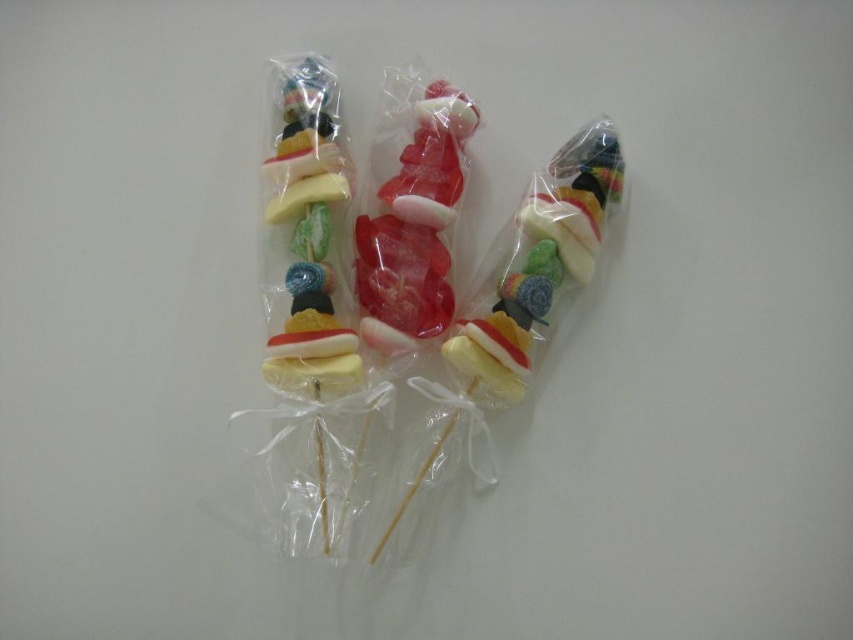
Between translucent plastic lollipops at center and translucent rubber candy at center, which one is positioned higher?

translucent rubber candy at center is above.

Between point (355, 524) and point (581, 138), which one is positioned in front?

Positioned in front is point (355, 524).

Identify the location of translucent plastic lollipops at center. (404, 305).

Does translucent plastic lollipops at center have a greater height compared to translucent plastic candy at center?

Yes.

Measure the distance between translucent plastic lollipops at center and translucent plastic candy at center.

A distance of 2.48 inches exists between translucent plastic lollipops at center and translucent plastic candy at center.

Locate an element on the screen. translucent plastic lollipops at center is located at coordinates (404, 305).

Image resolution: width=853 pixels, height=640 pixels. I want to click on translucent plastic lollipops at center, so click(x=404, y=305).

Is point (405, 342) closer to camera compared to point (534, 328)?

Yes.

Can you confirm if translucent plastic candy at center is thinner than translucent rubber candy at center?

Correct, translucent plastic candy at center's width is less than translucent rubber candy at center's.

Does point (416, 172) come in front of point (584, 141)?

Yes.

The height and width of the screenshot is (640, 853). Identify the location of translucent plastic candy at center. (410, 220).